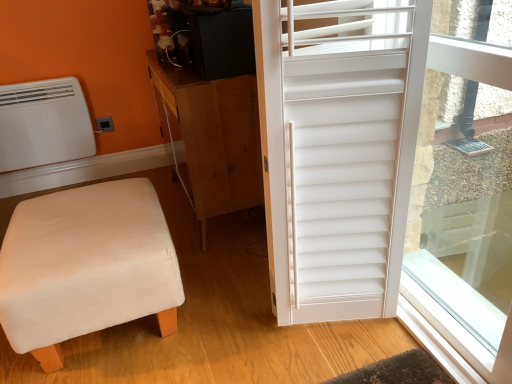
You are a GUI agent. You are given a task and a screenshot of the screen. Output one action in this format:
    pyautogui.click(x=<x>, y=<y>)
    Task: Click on the free area in between beige fabric stool at lower left and white matte shutter at right
    The image size is (512, 384).
    Given the screenshot: What is the action you would take?
    pyautogui.click(x=212, y=309)